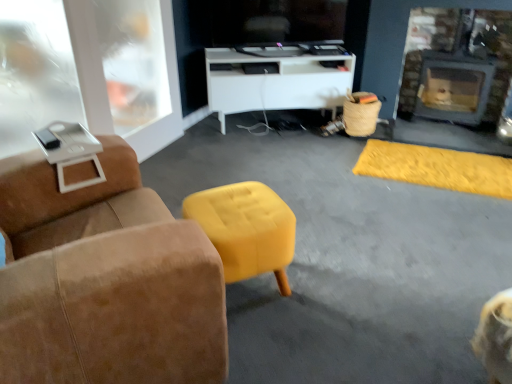
Where is `free space in front of white glossy cabinet at center`? Image resolution: width=512 pixels, height=384 pixels. free space in front of white glossy cabinet at center is located at coordinates (272, 157).